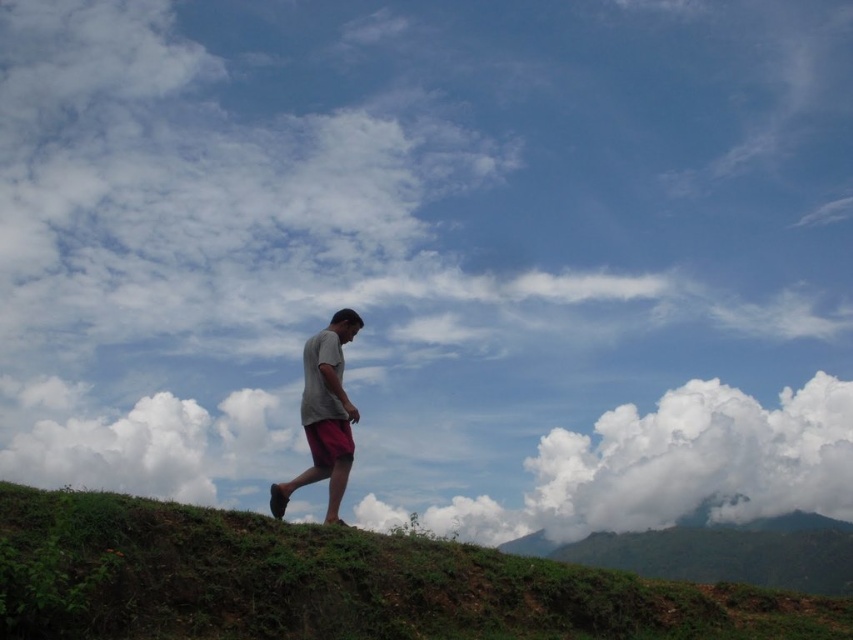
Question: Is white fluffy cloud at upper left to the left of gray matte shirt at center from the viewer's perspective?

Choices:
 (A) yes
 (B) no

Answer: (A)

Question: Among these objects, which one is farthest from the camera?

Choices:
 (A) white fluffy cloud at right
 (B) white fluffy cloud at upper left
 (C) green grassy hillside at center

Answer: (A)

Question: Which object appears closest to the camera in this image?

Choices:
 (A) red cotton shorts at center
 (B) white fluffy cloud at right
 (C) gray matte shirt at center

Answer: (C)

Question: Estimate the real-world distances between objects in this image. Which object is farther from the white fluffy cloud at right?

Choices:
 (A) white fluffy cloud at upper left
 (B) green leafy hillside at lower right
 (C) gray matte shirt at center

Answer: (C)

Question: Is green leafy hillside at lower right to the left of red cotton shorts at center from the viewer's perspective?

Choices:
 (A) no
 (B) yes

Answer: (A)

Question: Is green grassy hillside at center to the right of white fluffy cloud at right from the viewer's perspective?

Choices:
 (A) no
 (B) yes

Answer: (A)